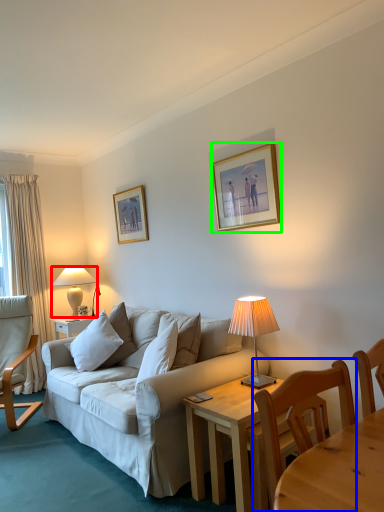
Question: Which object is positioned farthest from lamp (highlighted by a red box)? Select from chair (highlighted by a blue box) and picture frame (highlighted by a green box).

Choices:
 (A) chair
 (B) picture frame

Answer: (A)